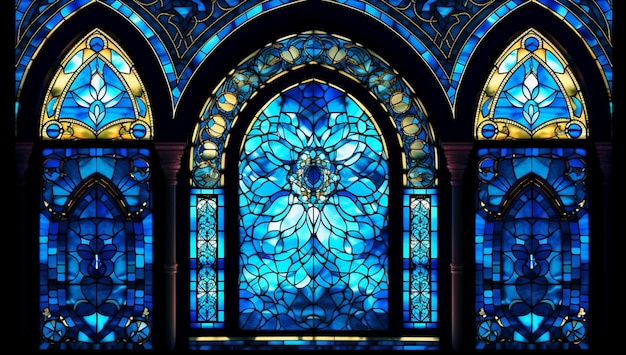
Image resolution: width=626 pixels, height=355 pixels. Identify the location of black border around middle arch window. (308, 73).